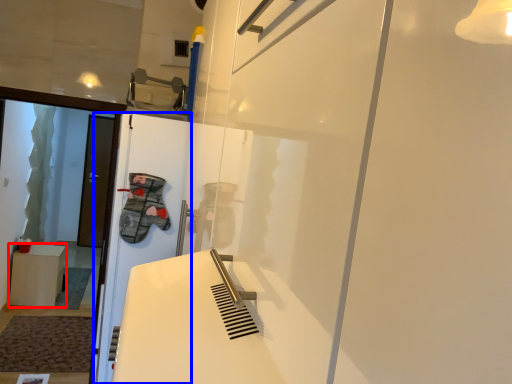
Question: Which object is closer to the camera taking this photo, furniture (highlighted by a red box) or screen door (highlighted by a blue box)?

Choices:
 (A) furniture
 (B) screen door

Answer: (B)